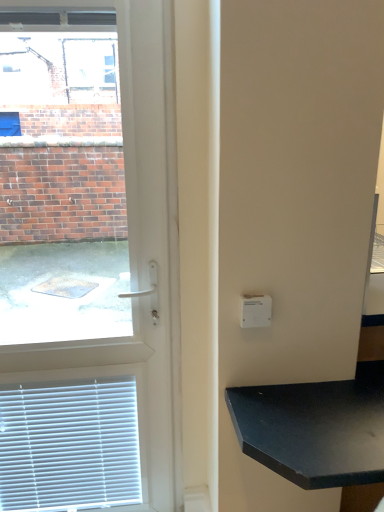
Find the location of `black matte table at lower right`. black matte table at lower right is located at coordinates (315, 428).

Find the location of `white plastic door at left`. white plastic door at left is located at coordinates (137, 251).

What do you see at coordinates (137, 251) in the screenshot? I see `white plastic door at left` at bounding box center [137, 251].

What is the approximate height of white plastic light switch at upper right?

white plastic light switch at upper right is 3.83 inches tall.

Identify the location of black matte table at lower right. (315, 428).

From a real-world perspective, is black matte table at lower right on white plastic door at left?

No, from a real-world perspective, black matte table at lower right is not above white plastic door at left.

Would you consider black matte table at lower right to be distant from white plastic door at left?

No.

Is black matte table at lower right facing towards white plastic door at left?

No, black matte table at lower right is not turned towards white plastic door at left.

Which of these two, black matte table at lower right or white plastic door at left, is thinner?

With smaller width is white plastic door at left.

Do you think white plastic door at left is within black matte table at lower right, or outside of it?

white plastic door at left is spatially situated outside black matte table at lower right.

How different are the orientations of white plastic door at left and black matte table at lower right in degrees?

The angular difference between white plastic door at left and black matte table at lower right is 0.097 degrees.

Looking at this image, considering the relative sizes of white plastic door at left and black matte table at lower right in the image provided, is white plastic door at left wider than black matte table at lower right?

No, white plastic door at left is not wider than black matte table at lower right.

From the image's perspective, is white plastic door at left under black matte table at lower right?

Actually, white plastic door at left appears above black matte table at lower right in the image.

From a real-world perspective, which object rests below the other?

white plastic door at left.

Considering the relative sizes of white plastic door at left and white plastic light switch at upper right in the image provided, is white plastic door at left taller than white plastic light switch at upper right?

Correct, white plastic door at left is much taller as white plastic light switch at upper right.

Do you think white plastic door at left is within white plastic light switch at upper right, or outside of it?

white plastic door at left lies outside white plastic light switch at upper right.

Can you confirm if white plastic light switch at upper right is taller than white plastic door at left?

Incorrect, the height of white plastic light switch at upper right is not larger of that of white plastic door at left.

Is white plastic light switch at upper right far away from white plastic door at left?

Actually, white plastic light switch at upper right and white plastic door at left are a little close together.

From a real-world perspective, does white plastic light switch at upper right stand above white plastic door at left?

Yes, from a real-world perspective, white plastic light switch at upper right is over white plastic door at left

Does point (258, 300) come in front of point (88, 348)?

Yes, point (258, 300) is in front of point (88, 348).

From the image's perspective, which is below, black matte table at lower right or white plastic light switch at upper right?

From the image's view, black matte table at lower right is below.

Is black matte table at lower right positioned in front of white plastic light switch at upper right?

Yes, the depth of black matte table at lower right is less than that of white plastic light switch at upper right.

From the picture: Is black matte table at lower right inside or outside of white plastic light switch at upper right?

black matte table at lower right is not enclosed by white plastic light switch at upper right.

Is black matte table at lower right a part of white plastic light switch at upper right?

No.

What's the angular difference between white plastic light switch at upper right and black matte table at lower right's facing directions?

The facing directions of white plastic light switch at upper right and black matte table at lower right are 0.871 degrees apart.

From the picture: Considering the relative positions of white plastic light switch at upper right and black matte table at lower right in the image provided, is white plastic light switch at upper right to the left of black matte table at lower right from the viewer's perspective?

Yes.

Is black matte table at lower right at the back of white plastic light switch at upper right?

No.

The width and height of the screenshot is (384, 512). I want to click on door on the left of black matte table at lower right, so 137,251.

This screenshot has height=512, width=384. In the image, there is a white plastic door at left. In order to click on table below it (from a real-world perspective) in this screenshot , I will do `click(315, 428)`.

When comparing their distances from white plastic door at left, does black matte table at lower right or white plastic light switch at upper right seem closer?

white plastic light switch at upper right lies closer to white plastic door at left than the other object.

Which object lies nearer to the anchor point white plastic door at left, white plastic light switch at upper right or black matte table at lower right?

The object closer to white plastic door at left is white plastic light switch at upper right.

Looking at the image, which one is located closer to black matte table at lower right, white plastic light switch at upper right or white plastic door at left?

The object closer to black matte table at lower right is white plastic light switch at upper right.

Based on their spatial positions, is black matte table at lower right or white plastic door at left further from white plastic light switch at upper right?

white plastic door at left lies further to white plastic light switch at upper right than the other object.

From the image, which object appears to be farther from white plastic light switch at upper right, white plastic door at left or black matte table at lower right?

white plastic door at left lies further to white plastic light switch at upper right than the other object.

Based on their spatial positions, is white plastic door at left or white plastic light switch at upper right closer to black matte table at lower right?

Based on the image, white plastic light switch at upper right appears to be nearer to black matte table at lower right.

This screenshot has width=384, height=512. I want to click on light switch between white plastic door at left and black matte table at lower right from left to right, so click(x=255, y=311).